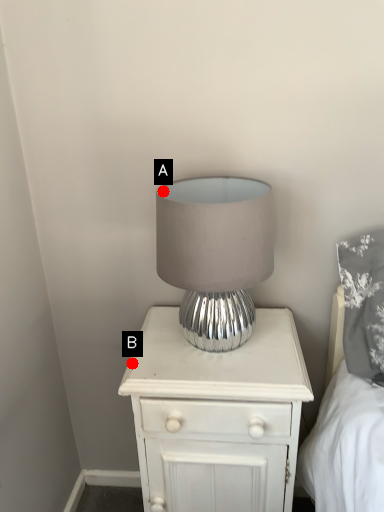
Question: Two points are circled on the image, labeled by A and B beside each circle. Which point is closer to the camera taking this photo?

Choices:
 (A) A is closer
 (B) B is closer

Answer: (A)